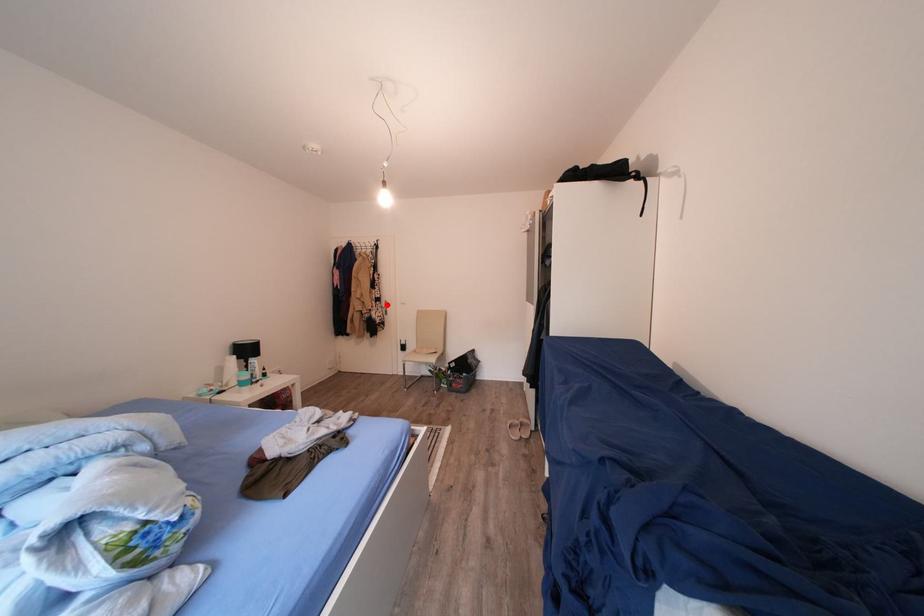
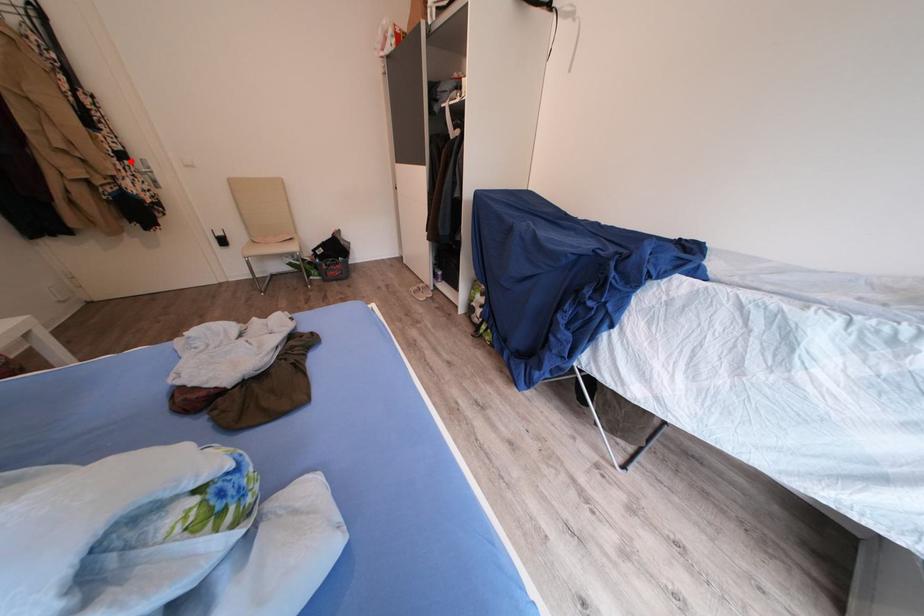
I am providing you with two images of the same scene from different viewpoints. A red point is marked on the first image and another point is marked on the second image. Does the point marked in image1 correspond to the same location as the one in image2?

Yes